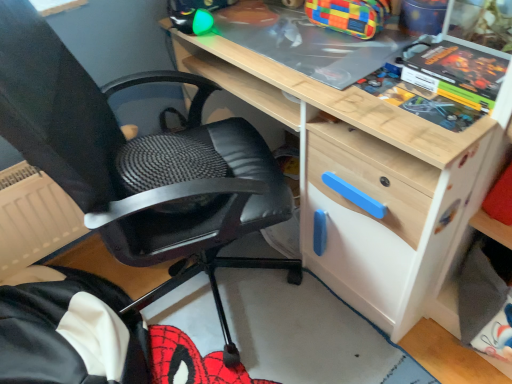
Question: Considering the positions of point (122, 218) and point (480, 107), is point (122, 218) closer or farther from the camera than point (480, 107)?

Choices:
 (A) closer
 (B) farther

Answer: (B)

Question: Considering their positions, is black leather chair at center located in front of or behind matt black comic book at upper right?

Choices:
 (A) front
 (B) behind

Answer: (A)

Question: Considering the relative positions of black leather chair at center and matt black comic book at upper right in the image provided, is black leather chair at center to the left or to the right of matt black comic book at upper right?

Choices:
 (A) right
 (B) left

Answer: (B)

Question: Is matt black comic book at upper right spatially inside black leather chair at center, or outside of it?

Choices:
 (A) outside
 (B) inside

Answer: (A)

Question: In terms of height, does matt black comic book at upper right look taller or shorter compared to black leather chair at center?

Choices:
 (A) tall
 (B) short

Answer: (B)

Question: Is point (457, 59) positioned closer to the camera than point (45, 41)?

Choices:
 (A) closer
 (B) farther

Answer: (A)

Question: Is matt black comic book at upper right wider or thinner than black leather chair at center?

Choices:
 (A) wide
 (B) thin

Answer: (B)